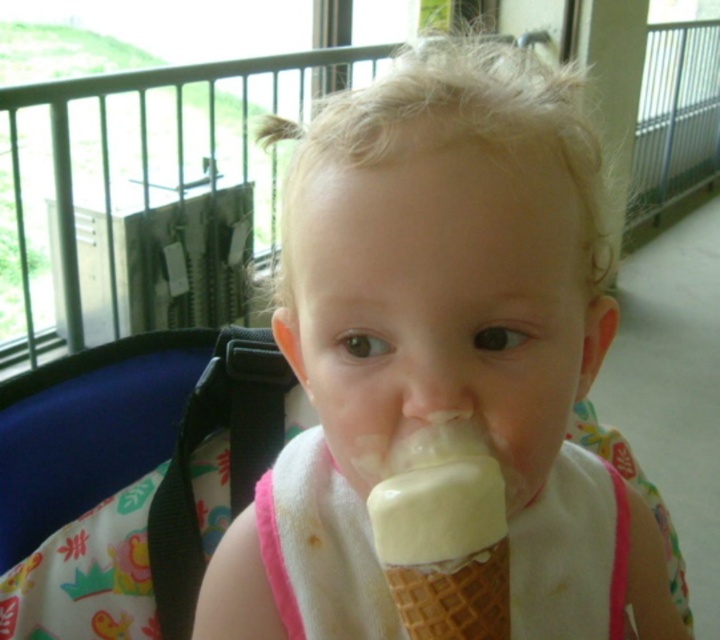
Question: Is the position of white matte ice cream cone at center less distant than that of vanilla ice cream at mouth?

Choices:
 (A) no
 (B) yes

Answer: (A)

Question: Among these points, which one is nearest to the camera?

Choices:
 (A) (325, 477)
 (B) (528, 308)
 (C) (500, 572)

Answer: (C)

Question: Which point is farther to the camera?

Choices:
 (A) (508, 596)
 (B) (354, 632)

Answer: (B)

Question: Does white fabric bib at mouth have a larger size compared to vanilla ice cream at mouth?

Choices:
 (A) yes
 (B) no

Answer: (A)

Question: Which of the following is the closest to the observer?

Choices:
 (A) (312, 481)
 (B) (413, 486)

Answer: (B)

Question: Can you confirm if white matte ice cream cone at center is positioned above vanilla ice cream at mouth?

Choices:
 (A) yes
 (B) no

Answer: (A)